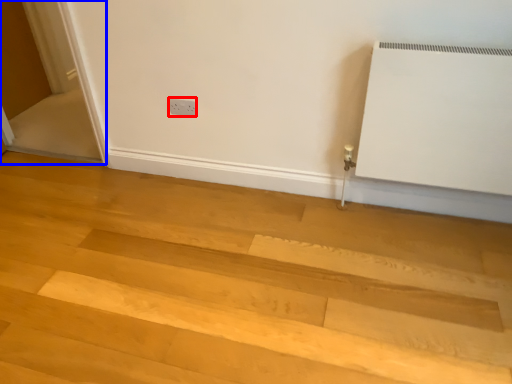
Question: Which object appears farthest to the camera in this image, electric outlet (highlighted by a red box) or screen door (highlighted by a blue box)?

Choices:
 (A) electric outlet
 (B) screen door

Answer: (A)